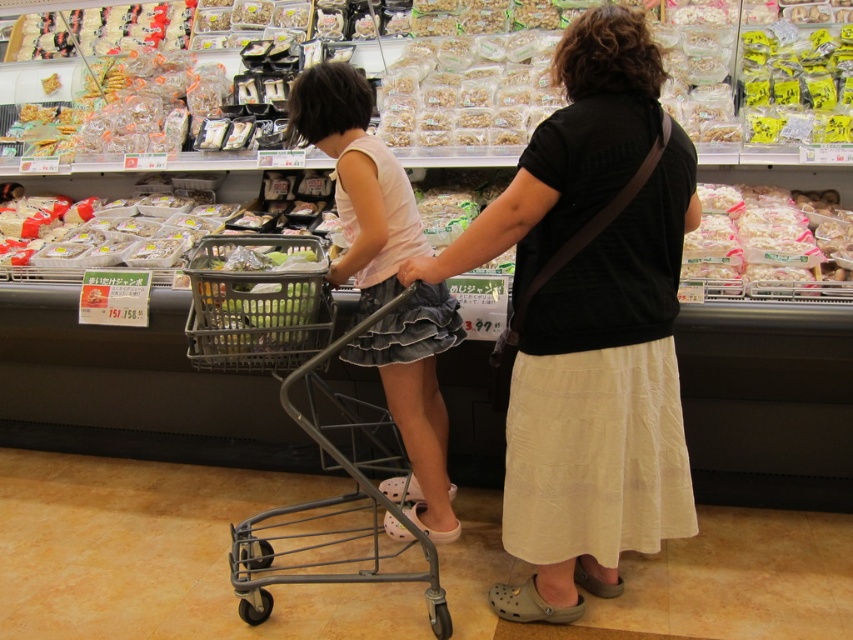
In the scene shown: You are a store employee who needs to place a new sign on the shelf. The sign must be placed between the translucent plastic bag at upper right and the yellow plastic bag at upper right. Which bag should the sign be closer to if the sign is 10 cm tall?

The translucent plastic bag at upper right is shorter than the yellow plastic bag at upper right. Since the sign is 10 cm tall, it should be placed closer to the translucent plastic bag at upper right to ensure it is visible over the bag.

You are standing in the grocery store and want to determine which of the two points, point (751, 195) or point (161, 216), is nearer to you. Based on the scene description, which point is closer?

Point (751, 195) is closer to the viewer than point (161, 216).